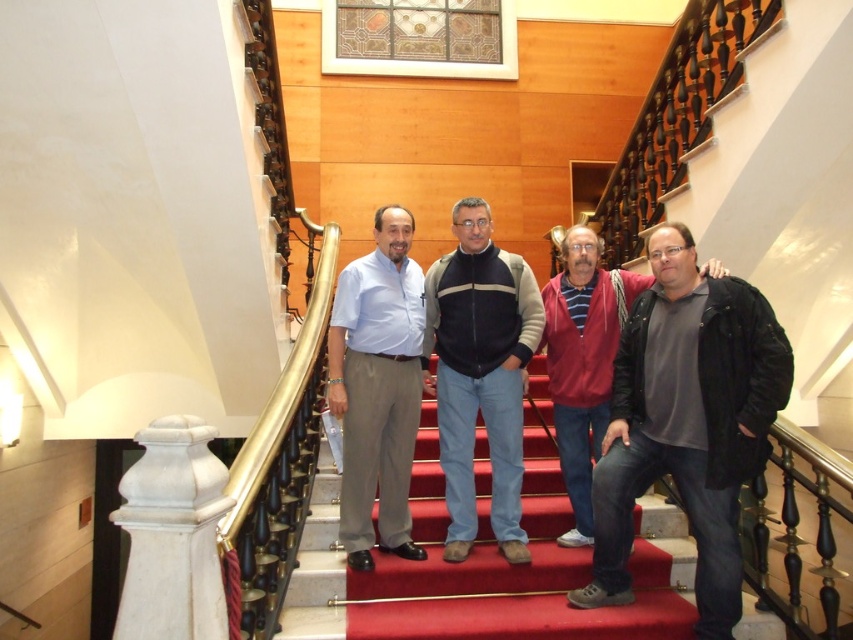
Question: Can you confirm if dark blue and beige jacket at center is positioned below matte light blue shirt at center?

Choices:
 (A) yes
 (B) no

Answer: (B)

Question: In this image, where is dark gray matte jacket at center located relative to matte light blue shirt at center?

Choices:
 (A) left
 (B) right

Answer: (B)

Question: Which point is closer to the camera?

Choices:
 (A) (616, 544)
 (B) (389, 333)
 (C) (467, 586)
 (D) (444, 364)

Answer: (A)

Question: Is dark gray matte jacket at center to the right of dark blue and beige jacket at center from the viewer's perspective?

Choices:
 (A) no
 (B) yes

Answer: (B)

Question: Which of the following is the closest to the observer?

Choices:
 (A) red carpet at center
 (B) dark gray matte jacket at center
 (C) dark blue and beige jacket at center

Answer: (B)

Question: Which of the following is the closest to the observer?

Choices:
 (A) dark blue and beige jacket at center
 (B) red carpet at center

Answer: (B)